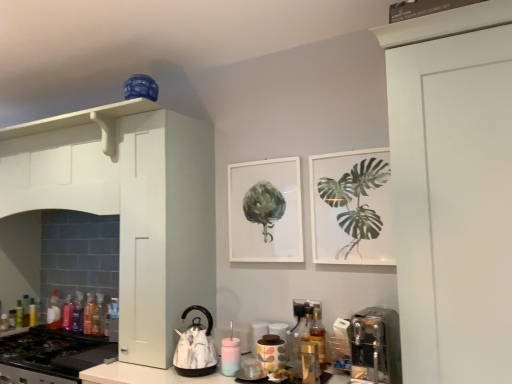
Question: Is black matte gas stove at lower left not close to translucent plastic bottle at lower left, the 3th bottle viewed from the right?

Choices:
 (A) yes
 (B) no

Answer: (B)

Question: From the image's perspective, is black matte gas stove at lower left over translucent plastic bottle at lower left, the 3th bottle from the front?

Choices:
 (A) yes
 (B) no

Answer: (B)

Question: Is black matte gas stove at lower left further to camera compared to translucent plastic bottle at lower left, the seventh bottle when ordered from back to front?

Choices:
 (A) yes
 (B) no

Answer: (B)

Question: Is black matte gas stove at lower left oriented away from translucent plastic bottle at lower left, the 3th bottle viewed from the right?

Choices:
 (A) no
 (B) yes

Answer: (A)

Question: Does black matte gas stove at lower left have a lesser width compared to translucent plastic bottle at lower left, acting as the seventh bottle starting from the left?

Choices:
 (A) no
 (B) yes

Answer: (A)

Question: Is the depth of black matte gas stove at lower left less than that of translucent plastic bottle at lower left, the seventh bottle when ordered from back to front?

Choices:
 (A) yes
 (B) no

Answer: (A)

Question: Could you tell me if translucent plastic bottles at left, which is the 6th bottle in back-to-front order, is facing translucent plastic bottle at lower left, the 2th bottle when ordered from right to left?

Choices:
 (A) yes
 (B) no

Answer: (B)

Question: Considering the relative positions of translucent plastic bottles at left, the fourth bottle when ordered from front to back, and translucent plastic bottle at lower left, the 2th bottle when ordered from right to left, in the image provided, is translucent plastic bottles at left, the fourth bottle when ordered from front to back, to the left of translucent plastic bottle at lower left, the 2th bottle when ordered from right to left, from the viewer's perspective?

Choices:
 (A) yes
 (B) no

Answer: (A)

Question: Is there a large distance between translucent plastic bottles at left, which is the 6th bottle in back-to-front order, and translucent plastic bottle at lower left, acting as the 8th bottle starting from the left?

Choices:
 (A) yes
 (B) no

Answer: (B)

Question: From the image's perspective, is translucent plastic bottles at left, the sixth bottle positioned from the left, beneath translucent plastic bottle at lower left, the eighth bottle positioned from the back?

Choices:
 (A) yes
 (B) no

Answer: (B)

Question: Is translucent plastic bottles at left, the 4th bottle in the right-to-left sequence, outside translucent plastic bottle at lower left, which is the second bottle from front to back?

Choices:
 (A) no
 (B) yes

Answer: (B)

Question: Is translucent plastic bottles at left, the 4th bottle in the right-to-left sequence, surrounding translucent plastic bottle at lower left, the 2th bottle when ordered from right to left?

Choices:
 (A) no
 (B) yes

Answer: (A)

Question: Can you confirm if green leafy plant at upper right is bigger than white glossy kettle at lower center, which is the 1th appliance in left-to-right order?

Choices:
 (A) no
 (B) yes

Answer: (A)